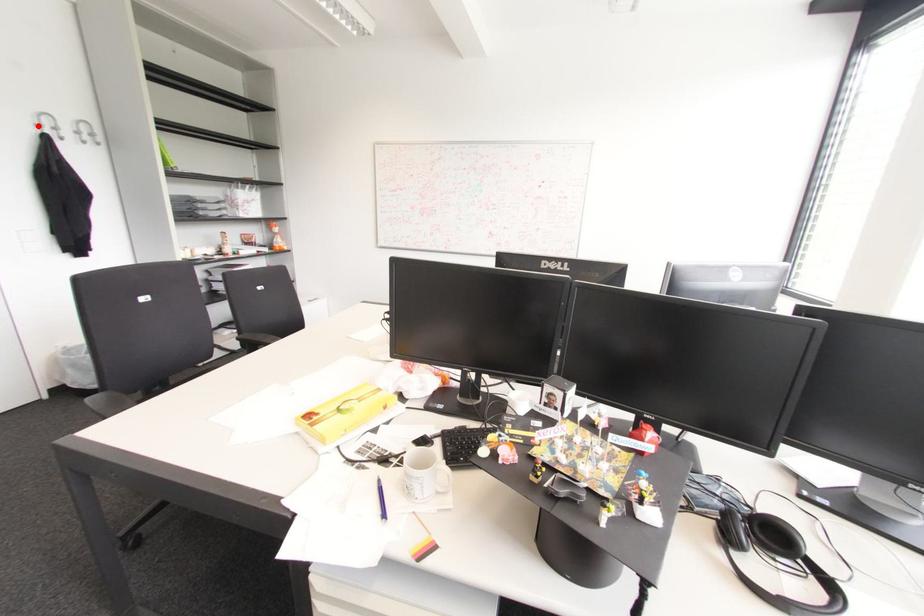
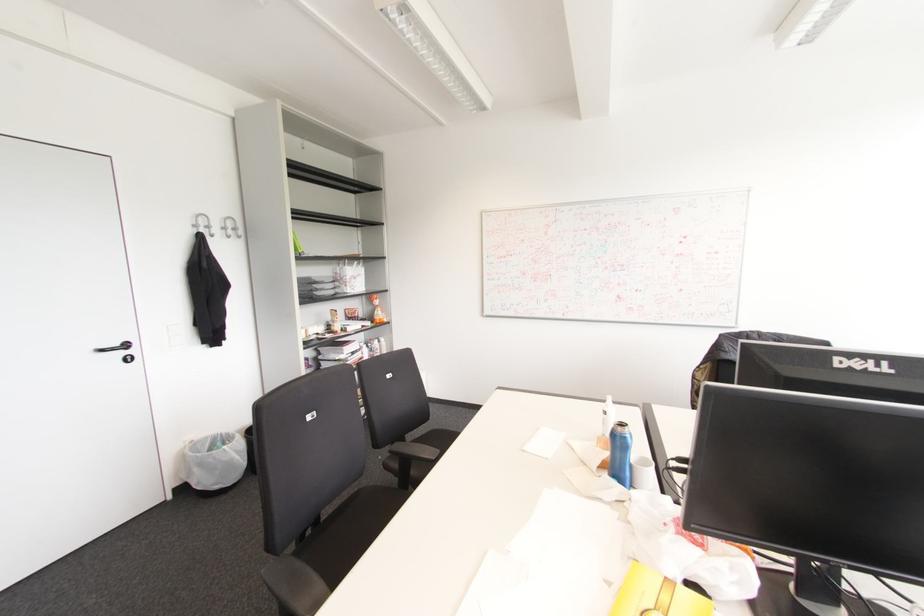
Question: I am providing you with two images of the same scene from different viewpoints. Given a red point in image1, look at the same physical point in image2. Is it:

Choices:
 (A) Closer to the viewpoint
 (B) Farther from the viewpoint

Answer: (A)